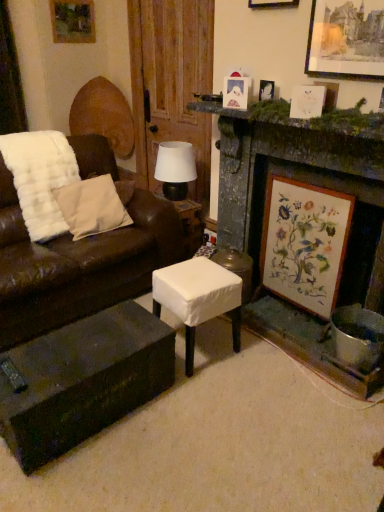
Image resolution: width=384 pixels, height=512 pixels. Find the location of `unoccupied region to the right of dark wood coffee table at lower center`. unoccupied region to the right of dark wood coffee table at lower center is located at coordinates (197, 426).